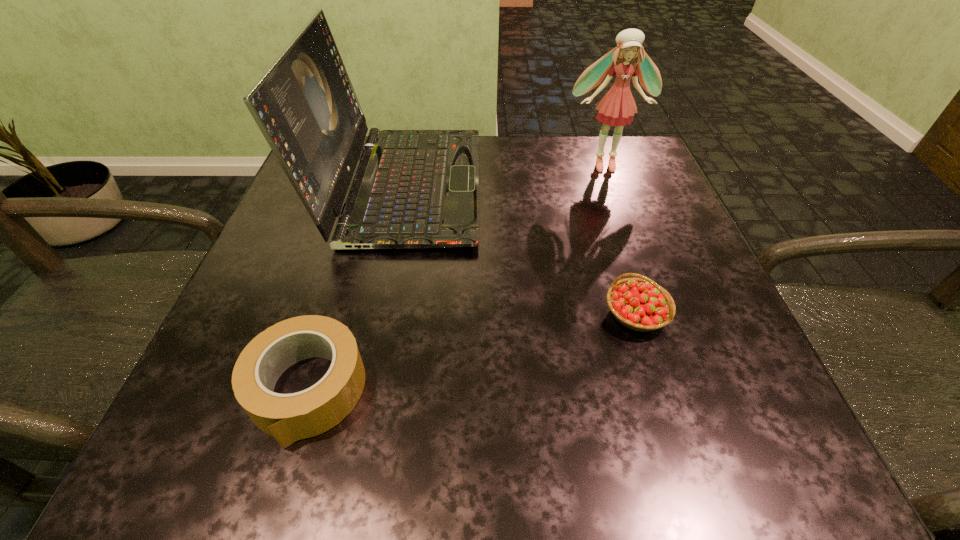
Identify the location of laptop computer. [x=413, y=188].

Find the location of a particular element. The image size is (960, 540). doll is located at coordinates (616, 108).

This screenshot has width=960, height=540. I want to click on strawberry, so click(640, 304).

Locate an element on the screen. The height and width of the screenshot is (540, 960). the shortest object is located at coordinates (288, 418).

I want to click on vacant position located 0.080m on the screen of the laptop computer, so click(x=516, y=186).

In order to click on vacant space situated 0.090m on the front-facing side of the doll in this screenshot , I will do `click(616, 199)`.

Where is `free spot located on the right of the strawberry`? free spot located on the right of the strawberry is located at coordinates [x=713, y=314].

Find the location of a particular element. This screenshot has height=540, width=960. laptop computer positioned at the far edge is located at coordinates (413, 188).

In order to click on doll that is at the far edge in this screenshot , I will do [616, 108].

Identify the location of object that is at the near edge. pyautogui.click(x=288, y=418).